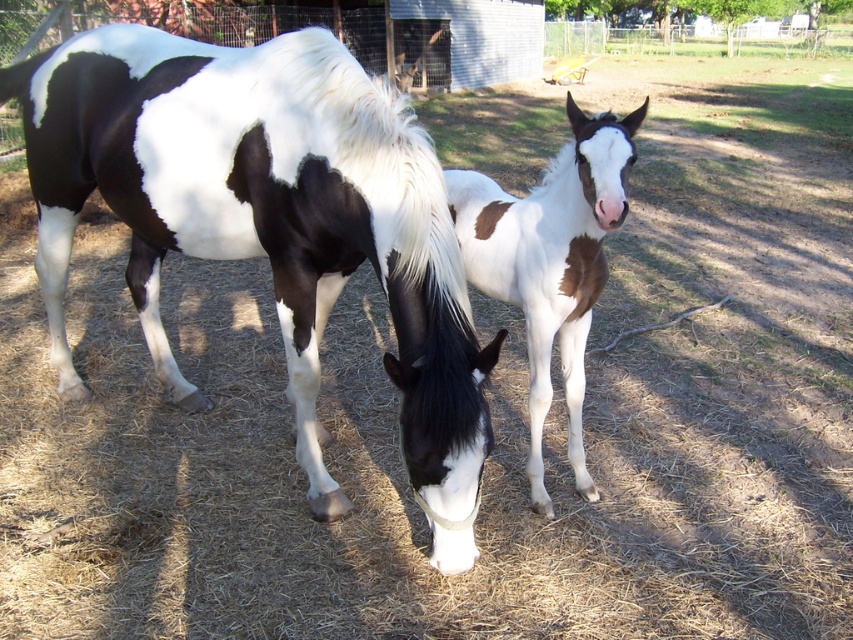
You are a farmer who wants to separate the black and white speckled horse at center and the white glossy horse at center into two different stalls. Since you can only lead the horse that is closer to you, which horse should you lead first?

The black and white speckled horse at center is closer to you than the white glossy horse at center, so you should lead the black and white speckled horse at center first.

You are standing at the point labeled as point (x=268, y=224) in the image. Which horse is directly in front of you?

The black and white speckled horse at center is directly in front of you at point (x=268, y=224).

You are a farmer who needs to separate the black and white speckled horse at center and the white glossy horse at center into two different stalls. Based on their positions in the image, which horse should you approach first to lead to its stall?

The black and white speckled horse at center is above the white glossy horse at center, so you should approach the black and white speckled horse at center first as it is positioned higher up in the image.